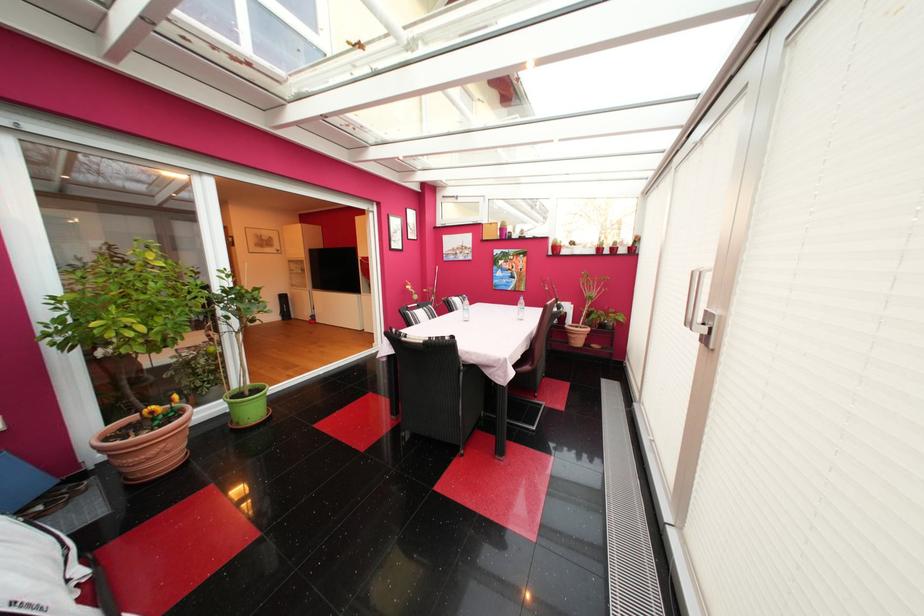
Image resolution: width=924 pixels, height=616 pixels. Find the location of `white door handle`. white door handle is located at coordinates (699, 307).